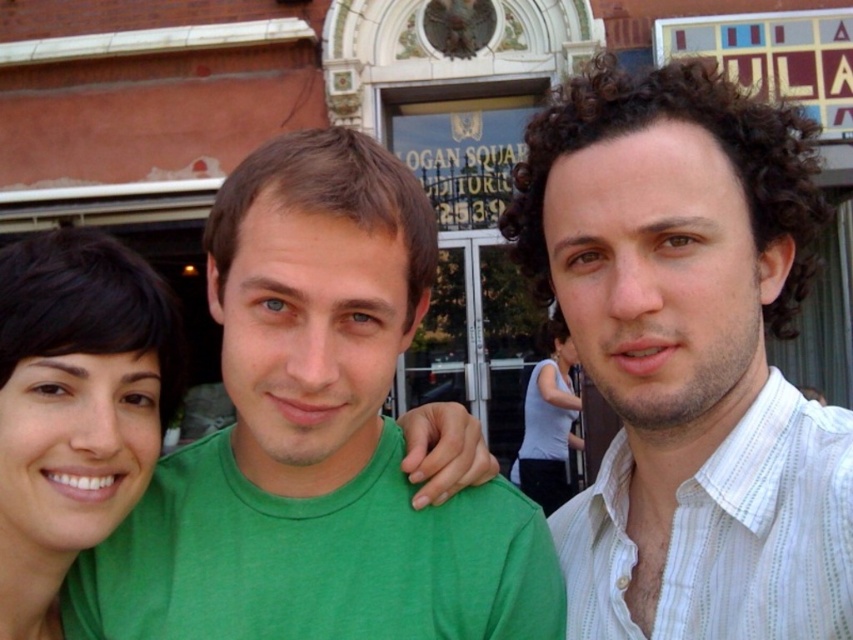
You are a photographer trying to capture a clear photo of the white matte tank top at center. However, the white striped shirt at right is blocking your view. Can you adjust your position to avoid the obstruction?

The white striped shirt at right is in front of the white matte tank top at center, so moving to the left side might allow you to see around the white striped shirt at right and get a clear shot of the white matte tank top at center.

You are standing in front of the brick building with the arched doorway. You see a point at coordinates [74,406]. Which object from the scene does this point correspond to?

The point at coordinates [74,406] corresponds to the matte green shirt at left.